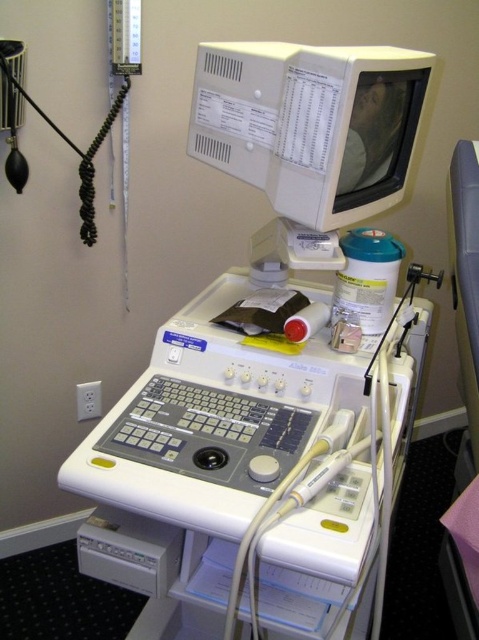
Is white plastic ultrasound machine at center bigger than white plastic monitor at center?

Correct, white plastic ultrasound machine at center is larger in size than white plastic monitor at center.

Is white plastic ultrasound machine at center closer to camera compared to white plastic monitor at center?

Yes, it is.

Between point (278, 612) and point (292, 196), which one is positioned in front?

Point (292, 196) is more forward.

Locate an element on the screen. This screenshot has height=640, width=479. white plastic ultrasound machine at center is located at coordinates (252, 465).